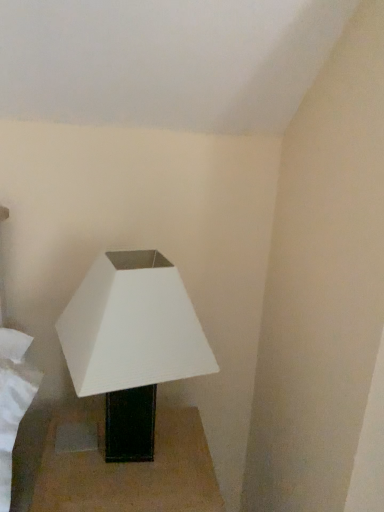
You are a GUI agent. You are given a task and a screenshot of the screen. Output one action in this format:
    pyautogui.click(x=<x>, y=<y>)
    Task: Click on the white matte lamp at lower left
    The image size is (384, 512).
    Given the screenshot: What is the action you would take?
    pyautogui.click(x=131, y=344)

The height and width of the screenshot is (512, 384). What do you see at coordinates (131, 344) in the screenshot?
I see `white matte lamp at lower left` at bounding box center [131, 344].

The image size is (384, 512). Describe the element at coordinates (130, 470) in the screenshot. I see `black glossy table at lower center` at that location.

In order to click on black glossy table at lower center in this screenshot , I will do `click(130, 470)`.

Where is `white matte lamp at lower left`? The image size is (384, 512). white matte lamp at lower left is located at coordinates (131, 344).

Between white matte lamp at lower left and black glossy table at lower center, which one appears on the right side from the viewer's perspective?

white matte lamp at lower left is more to the right.

Considering the positions of objects white matte lamp at lower left and black glossy table at lower center in the image provided, who is behind, white matte lamp at lower left or black glossy table at lower center?

black glossy table at lower center is further from the camera.

Is point (124, 375) closer or farther from the camera than point (189, 484)?

Clearly, point (124, 375) is closer to the camera than point (189, 484).

From the image's perspective, is white matte lamp at lower left over black glossy table at lower center?

Yes, from the image's perspective, white matte lamp at lower left is on top of black glossy table at lower center.

From a real-world perspective, is white matte lamp at lower left positioned under black glossy table at lower center based on gravity?

Incorrect, from a real-world perspective, white matte lamp at lower left is higher than black glossy table at lower center.

In terms of width, does white matte lamp at lower left look wider or thinner when compared to black glossy table at lower center?

Considering their sizes, white matte lamp at lower left looks slimmer than black glossy table at lower center.

Can you confirm if white matte lamp at lower left is shorter than black glossy table at lower center?

In fact, white matte lamp at lower left may be taller than black glossy table at lower center.

From the picture: Who is bigger, white matte lamp at lower left or black glossy table at lower center?

Bigger between the two is black glossy table at lower center.

Is white matte lamp at lower left not within black glossy table at lower center?

Absolutely, white matte lamp at lower left is external to black glossy table at lower center.

Would you say white matte lamp at lower left is a long distance from black glossy table at lower center?

No, white matte lamp at lower left is in close proximity to black glossy table at lower center.

Does white matte lamp at lower left turn towards black glossy table at lower center?

No, white matte lamp at lower left is not aimed at black glossy table at lower center.

How different are the orientations of white matte lamp at lower left and black glossy table at lower center in degrees?

The angular difference between white matte lamp at lower left and black glossy table at lower center is 0.000834 degrees.

The width and height of the screenshot is (384, 512). Identify the location of lamp that is above the black glossy table at lower center (from a real-world perspective). (131, 344).

Based on their positions, is black glossy table at lower center located to the left or right of white matte lamp at lower left?

black glossy table at lower center is to the left of white matte lamp at lower left.

Which object is further away from the camera, black glossy table at lower center or white matte lamp at lower left?

black glossy table at lower center is behind.

Which is farther, (60, 477) or (209, 373)?

The point (60, 477) is farther.

From the image's perspective, which is above, black glossy table at lower center or white matte lamp at lower left?

white matte lamp at lower left, from the image's perspective.

From a real-world perspective, who is located lower, black glossy table at lower center or white matte lamp at lower left?

From a 3D spatial view, black glossy table at lower center is below.

From the picture: Does black glossy table at lower center have a greater width compared to white matte lamp at lower left?

Yes, black glossy table at lower center is wider than white matte lamp at lower left.

In terms of height, does black glossy table at lower center look taller or shorter compared to white matte lamp at lower left?

black glossy table at lower center is shorter than white matte lamp at lower left.

Is black glossy table at lower center smaller than white matte lamp at lower left?

No.

In the scene shown: Is black glossy table at lower center completely or partially outside of white matte lamp at lower left?

Yes, black glossy table at lower center is located beyond the bounds of white matte lamp at lower left.

Based on the photo, is black glossy table at lower center placed right next to white matte lamp at lower left?

black glossy table at lower center and white matte lamp at lower left are not in contact.

Is black glossy table at lower center aimed at white matte lamp at lower left?

No, black glossy table at lower center is not turned towards white matte lamp at lower left.

What's the angular difference between black glossy table at lower center and white matte lamp at lower left's facing directions?

black glossy table at lower center and white matte lamp at lower left are facing 0.000834 degrees away from each other.

Measure the distance from black glossy table at lower center to white matte lamp at lower left.

A distance of 21.72 centimeters exists between black glossy table at lower center and white matte lamp at lower left.

Locate an element on the screen. lamp that is in front of the black glossy table at lower center is located at coordinates (131, 344).

At what (x,y) coordinates should I click in order to perform the action: click on table behind the white matte lamp at lower left. Please return your answer as a coordinate pair (x, y). The height and width of the screenshot is (512, 384). Looking at the image, I should click on (130, 470).

Locate an element on the screen. This screenshot has height=512, width=384. lamp above the black glossy table at lower center (from the image's perspective) is located at coordinates (131, 344).